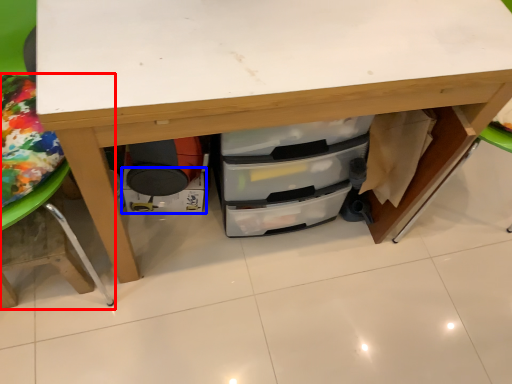
Question: Which object is closer to the camera taking this photo, furniture (highlighted by a red box) or drawer (highlighted by a blue box)?

Choices:
 (A) furniture
 (B) drawer

Answer: (A)